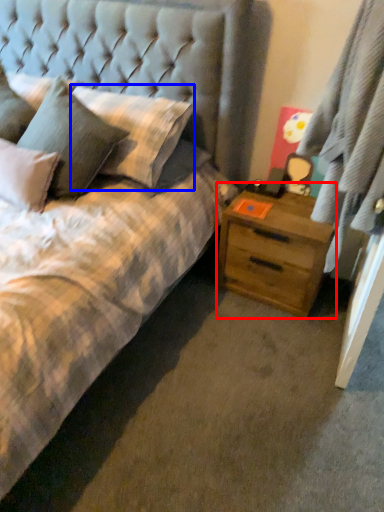
Question: Which object appears farthest to the camera in this image, nightstand (highlighted by a red box) or pillow (highlighted by a blue box)?

Choices:
 (A) nightstand
 (B) pillow

Answer: (A)